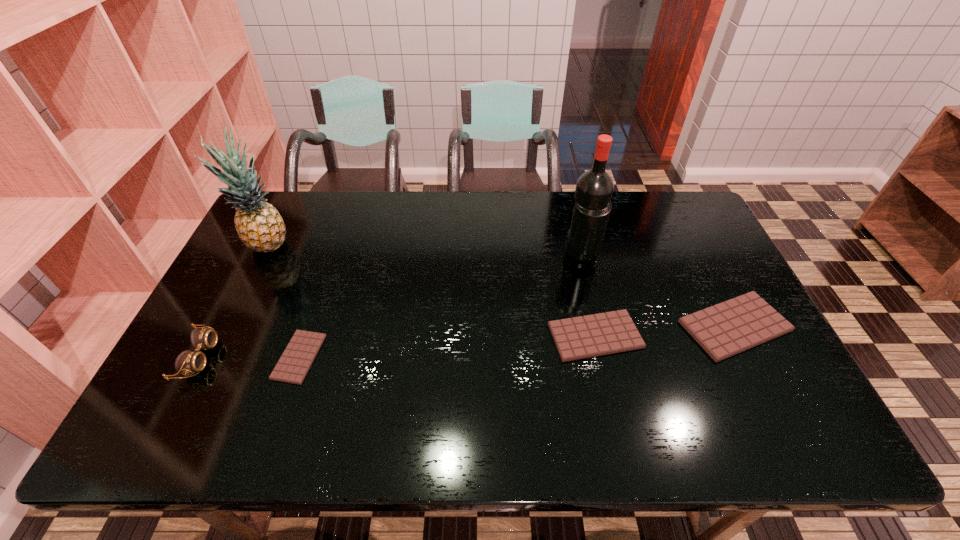
Where is `object that is at the far left corner`? The image size is (960, 540). object that is at the far left corner is located at coordinates (259, 225).

The width and height of the screenshot is (960, 540). What are the coordinates of `object located at the near left corner` in the screenshot? It's located at (188, 362).

Locate an element on the screen. The width and height of the screenshot is (960, 540). vacant space at the far edge is located at coordinates (366, 224).

Find the location of a particular element. This screenshot has height=540, width=960. blank space at the near edge of the desktop is located at coordinates (262, 401).

Identify the location of vacant space at the right edge of the desktop. (732, 370).

You are a GUI agent. You are given a task and a screenshot of the screen. Output one action in this format:
    pyautogui.click(x=<x>, y=<y>)
    Task: Click on the free region at the far left corner of the desktop
    The height and width of the screenshot is (540, 960).
    Given the screenshot: What is the action you would take?
    (292, 197)

At what (x,y) coordinates should I click in order to perform the action: click on vacant region at the far right corner of the desktop. Please return your answer as a coordinate pair (x, y). Looking at the image, I should click on (665, 232).

Locate an element on the screen. The height and width of the screenshot is (540, 960). vacant region at the near right corner of the desktop is located at coordinates (756, 385).

Find the location of a particular element. The height and width of the screenshot is (540, 960). free space between the third tallest object and the rightmost chocolate bar is located at coordinates (467, 342).

Locate an element on the screen. free spot between the rightmost chocolate bar and the wine bottle is located at coordinates (659, 289).